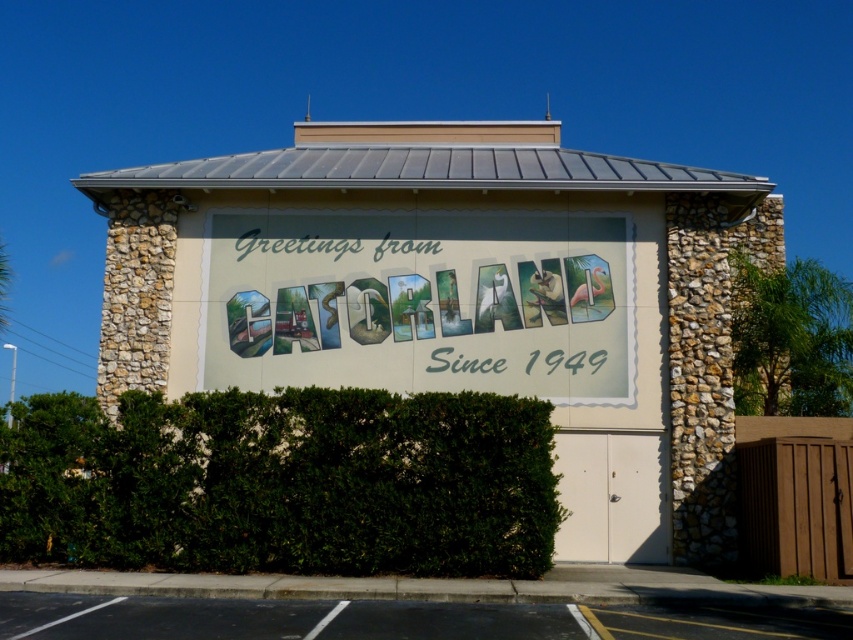
You are standing at the entrance of Gatorland and see the green leafy hedge at lower center and the black asphalt at lower center. Which one is positioned to the left side?

The green leafy hedge at lower center is positioned to the left of the black asphalt at lower center.

You are a delivery driver approaching the GATORLAND building and need to park your truck. The truck requires a parking space that is at least as wide as the black asphalt at lower center. Can the pastel painted sign at center provide enough width for your truck to park?

The pastel painted sign at center is thinner than the black asphalt at lower center, so the sign is narrower than the required parking space width. Therefore, the truck cannot park there as the sign is too narrow.